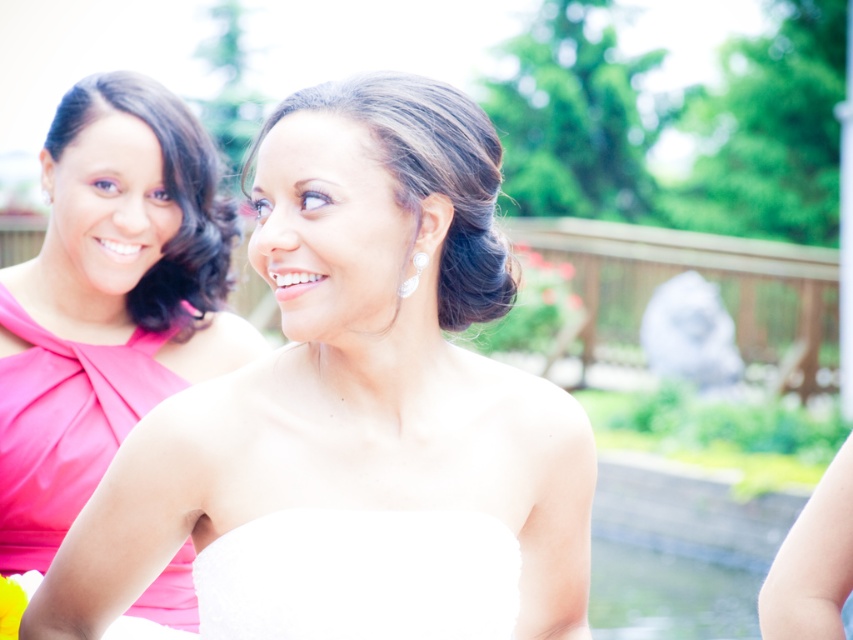
You are a photographer at a wedding event. You need to capture a photo of both the white satin dress at center and the matte pink dress at left in the same frame. The camera you are using has a minimum focus distance of 1 meter. Can you position yourself so that both dresses are in focus without moving either of them?

The distance between the white satin dress at center and the matte pink dress at left is 93.92 centimeters, which is less than the camera minimum focus distance of 1 meter. Therefore, you cannot capture both dresses in focus without moving them.

You are a photographer at a wedding and need to position two guests wearing the matte pink dress at left and the pink satin dress at left for a group photo. Based on their dress widths, which guest should stand closer to the center to avoid overlapping with others?

The matte pink dress at left is wider than the pink satin dress at left, so the guest wearing the matte pink dress at left should stand closer to the center to accommodate its width and prevent overlapping with others.